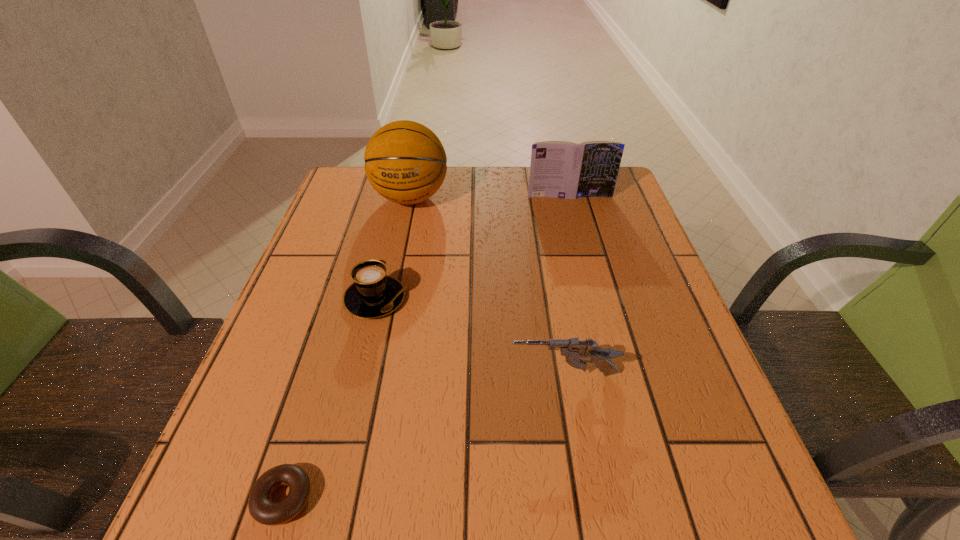
The height and width of the screenshot is (540, 960). Find the location of `vacant area that lies between the tallest object and the cappuccino`. vacant area that lies between the tallest object and the cappuccino is located at coordinates (393, 248).

You are a GUI agent. You are given a task and a screenshot of the screen. Output one action in this format:
    pyautogui.click(x=<x>, y=<y>)
    Task: Click on the vacant space that's between the basketball and the book
    Image resolution: width=960 pixels, height=540 pixels.
    Given the screenshot: What is the action you would take?
    pyautogui.click(x=490, y=197)

Where is `object that is the second closest one to the nearest object`? object that is the second closest one to the nearest object is located at coordinates (574, 350).

Choose which object is the nearest neighbor to the third shortest object. Please provide its 2D coordinates. Your answer should be formatted as a tuple, i.e. [(x, y)], where the tuple contains the x and y coordinates of a point satisfying the conditions above.

[(373, 294)]

The image size is (960, 540). What are the coordinates of `vacant position in the image that satisfies the following two spatial constraints: 1. on the front cover of the fourth shortest object; 2. at the barrel of the second nearest object` in the screenshot? It's located at (618, 375).